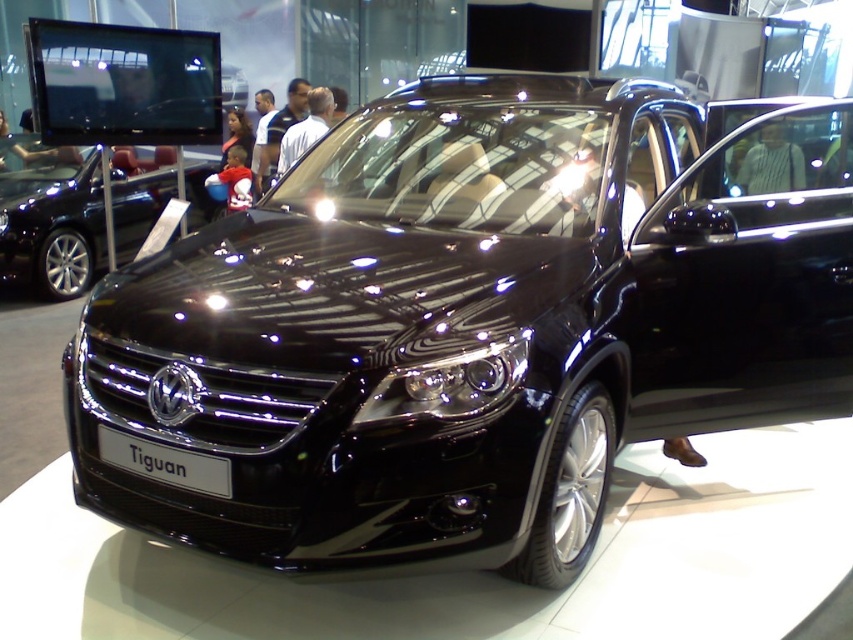
The width and height of the screenshot is (853, 640). What do you see at coordinates (450, 385) in the screenshot?
I see `glossy chrome headlight at center` at bounding box center [450, 385].

Can you confirm if glossy chrome headlight at center is positioned to the right of white plastic sign at center?

Indeed, glossy chrome headlight at center is positioned on the right side of white plastic sign at center.

Is point (408, 406) behind point (209, 483)?

No.

Locate an element on the screen. The width and height of the screenshot is (853, 640). glossy chrome headlight at center is located at coordinates (450, 385).

Does glossy black car at center appear under white plastic sign at center?

No.

Is glossy black car at center to the right of white plastic sign at center from the viewer's perspective?

Incorrect, glossy black car at center is not on the right side of white plastic sign at center.

Between point (155, 196) and point (230, 486), which one is positioned in front?

Point (230, 486) is in front.

Where is `glossy black car at center`? The image size is (853, 640). glossy black car at center is located at coordinates (51, 225).

Consider the image. Who is more distant from viewer, (13, 214) or (514, 364)?

The point (13, 214) is more distant.

Does point (16, 179) come behind point (398, 369)?

Yes.

Locate an element on the screen. This screenshot has height=640, width=853. glossy black car at center is located at coordinates (51, 225).